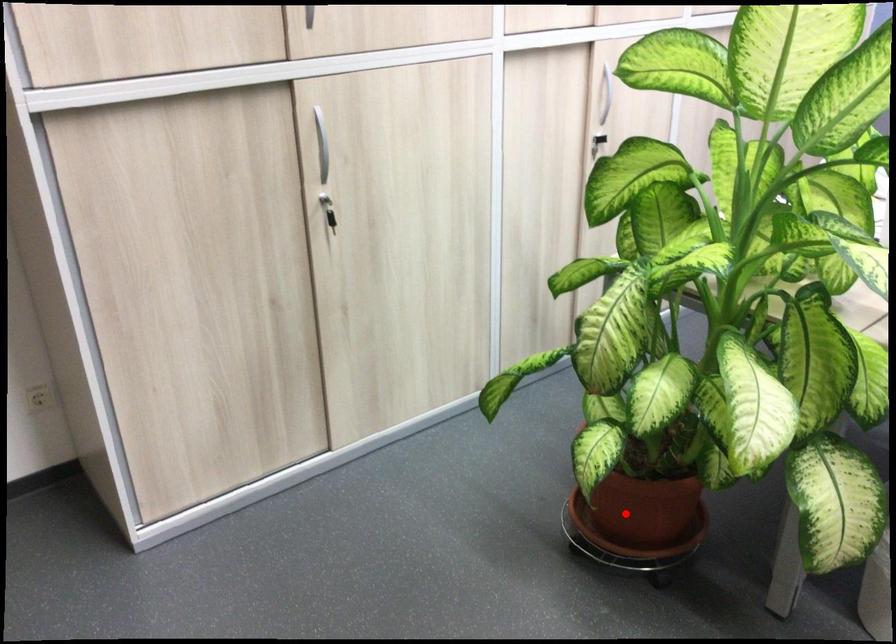
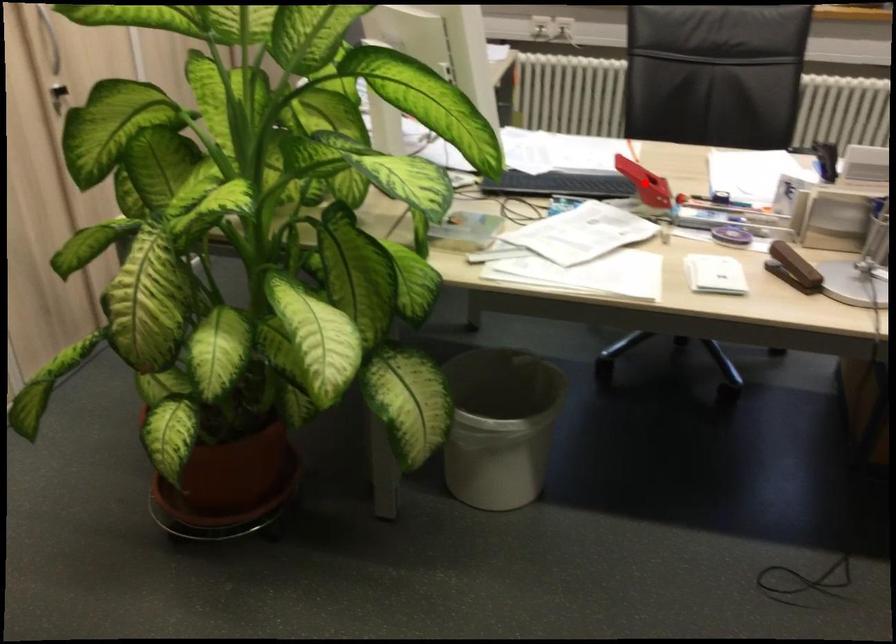
I am providing you with two images of the same scene from different viewpoints. A red point is marked on the first image and another point is marked on the second image. Is the marked point in image1 the same physical position as the marked point in image2?

No